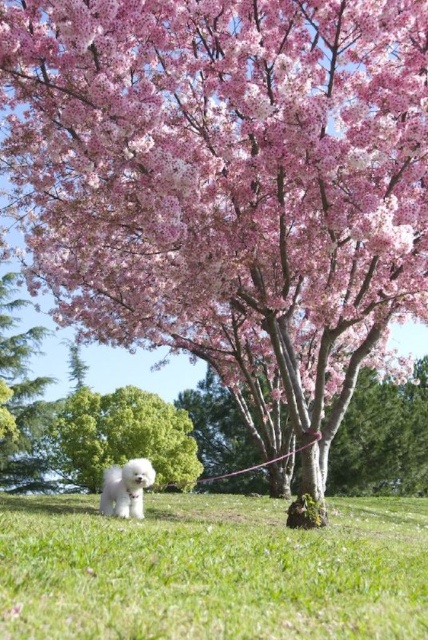
Is green grass at lower center wider than white fluffy dog at lower left?

Yes, green grass at lower center is wider than white fluffy dog at lower left.

Can you confirm if green grass at lower center is smaller than white fluffy dog at lower left?

Actually, green grass at lower center might be larger than white fluffy dog at lower left.

Image resolution: width=428 pixels, height=640 pixels. In order to click on green grass at lower center in this screenshot , I will do `click(211, 570)`.

Based on the photo, does pink matte tree at center come behind white fluffy dog at lower left?

Yes, it is behind white fluffy dog at lower left.

Measure the distance from pink matte tree at center to white fluffy dog at lower left.

They are 27.23 meters apart.

Is point (86, 349) closer to viewer compared to point (137, 477)?

No, it is not.

Where is `pink matte tree at center`? The width and height of the screenshot is (428, 640). pink matte tree at center is located at coordinates (139, 371).

Between green leafy tree at center and pink matte tree at center, which one has less height?

green leafy tree at center is shorter.

Between green leafy tree at center and pink matte tree at center, which one appears on the right side from the viewer's perspective?

Positioned to the right is green leafy tree at center.

Does point (79, 472) come farther from viewer compared to point (177, 390)?

No, (79, 472) is in front of (177, 390).

Locate an element on the screen. green leafy tree at center is located at coordinates (122, 436).